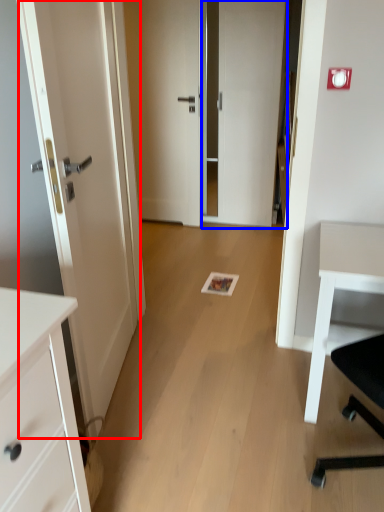
Question: Which object appears closest to the camera in this image, door (highlighted by a red box) or door (highlighted by a blue box)?

Choices:
 (A) door
 (B) door

Answer: (A)